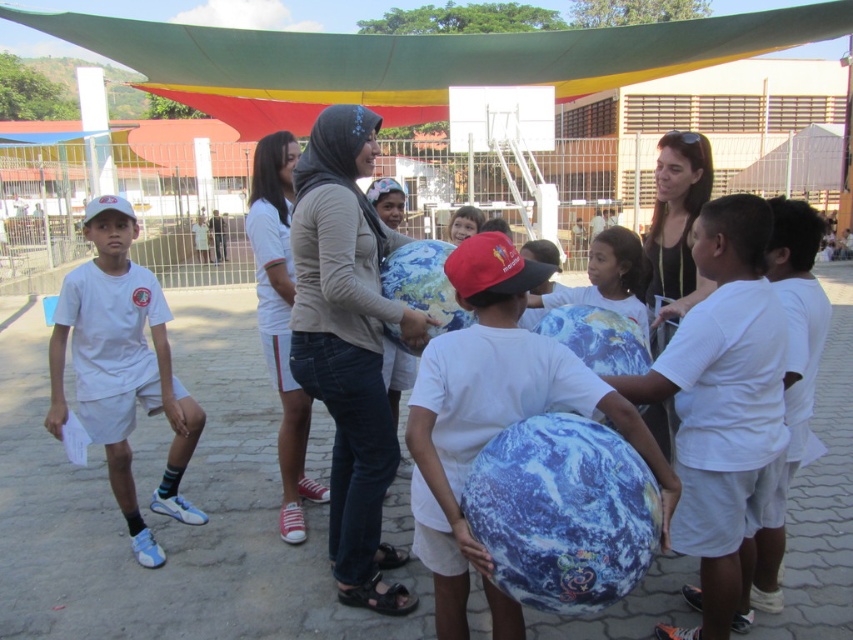
You are standing at the point marked as point (x=722, y=410) in the image. What object is directly in front of you?

The point (x=722, y=410) indicates white matte earth at center, so the object directly in front of you is the white matte earth at center.

You are a photographer positioned to the right of the denim jeans at center and smooth black shirt at center. You want to capture a photo that includes both subjects without moving them. Which subject should be on the left side of the photo?

The denim jeans at center should be on the left side of the photo because it is positioned to the left of the smooth black shirt at center.